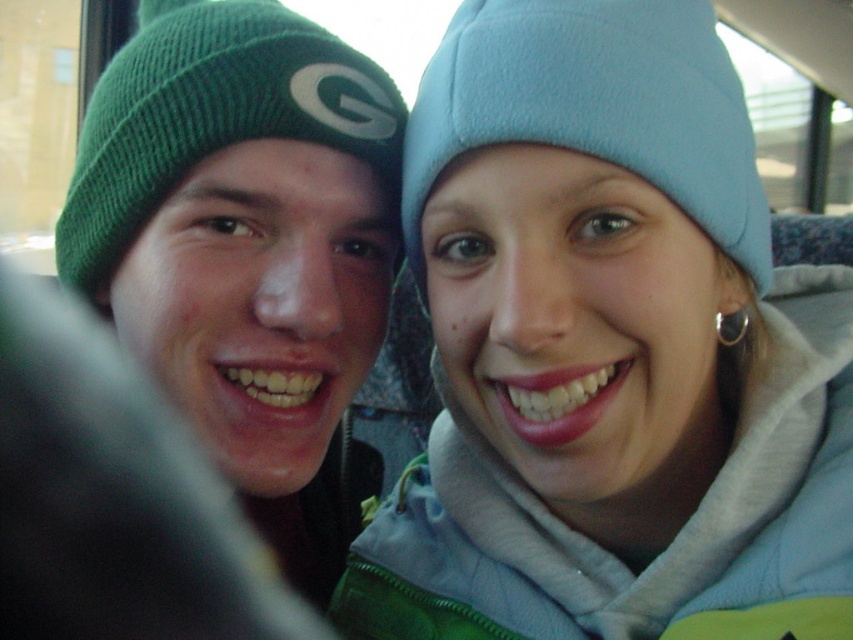
You are designing a display for a winter clothing store. You have two beanies to showcase. The light blue fleece beanie at upper right and the green knitted beanie at left. The store manager wants to highlight the thickness of each beanie. How should you arrange them to accurately represent their thickness?

Place the green knitted beanie at left closer to the customer since it is thicker than the light blue fleece beanie at upper right, allowing customers to easily compare their thicknesses.

You are designing a display for a winter clothing store and need to arrange the light blue fleece beanie at upper right and the green knitted beanie at left. The store manager wants the smaller item to be placed higher up to draw attention. Based on the image, which beanie should you place higher?

The light blue fleece beanie at upper right is smaller than the green knitted beanie at left, so you should place the light blue fleece beanie at upper right higher to follow the store manager